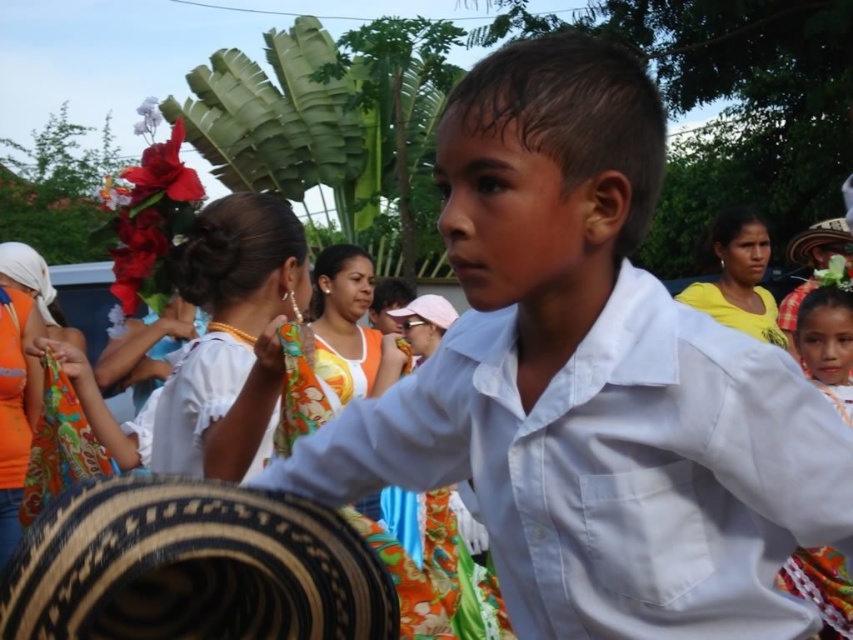
Question: Where is black woven sombrero at lower left located in relation to white cotton shirt at center in the image?

Choices:
 (A) left
 (B) right

Answer: (A)

Question: Which is nearer to the black woven sombrero at lower left?

Choices:
 (A) white matte shirt at center
 (B) white cotton shirt at center

Answer: (A)

Question: Which object is the closest to the white cotton shirt at center?

Choices:
 (A) white matte shirt at center
 (B) black woven sombrero at lower left

Answer: (A)

Question: Can you confirm if black woven sombrero at lower left is bigger than white cotton shirt at center?

Choices:
 (A) yes
 (B) no

Answer: (B)

Question: Considering the real-world distances, which object is farthest from the white cotton shirt at center?

Choices:
 (A) black woven sombrero at lower left
 (B) white matte shirt at center

Answer: (A)

Question: Does white matte shirt at center appear over black woven sombrero at lower left?

Choices:
 (A) no
 (B) yes

Answer: (B)